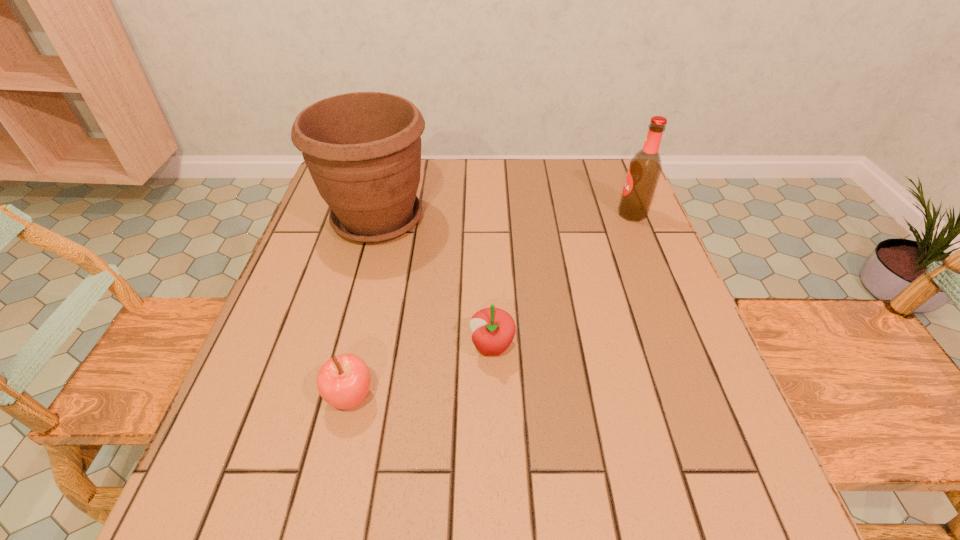
At what (x,y) coordinates should I click in order to perform the action: click on flowerpot. Please return your answer as a coordinate pair (x, y). This screenshot has height=540, width=960. Looking at the image, I should click on (363, 150).

The width and height of the screenshot is (960, 540). Identify the location of beer bottle. (645, 167).

This screenshot has width=960, height=540. What are the coordinates of `the third farthest object` in the screenshot? It's located at (493, 329).

Where is `the right apple`? This screenshot has height=540, width=960. the right apple is located at coordinates (493, 329).

The width and height of the screenshot is (960, 540). Identify the location of the nearest object. tap(343, 381).

Where is `the left apple`? The height and width of the screenshot is (540, 960). the left apple is located at coordinates (343, 381).

The width and height of the screenshot is (960, 540). Find the location of `vacant space located 0.380m on the right of the flowerpot`. vacant space located 0.380m on the right of the flowerpot is located at coordinates (582, 219).

I want to click on blank space located 0.190m on the back of the rightmost object, so click(x=613, y=167).

The width and height of the screenshot is (960, 540). I want to click on free location located on the right of the third farthest object, so click(608, 347).

I want to click on free space located 0.340m on the back of the nearer apple, so (384, 251).